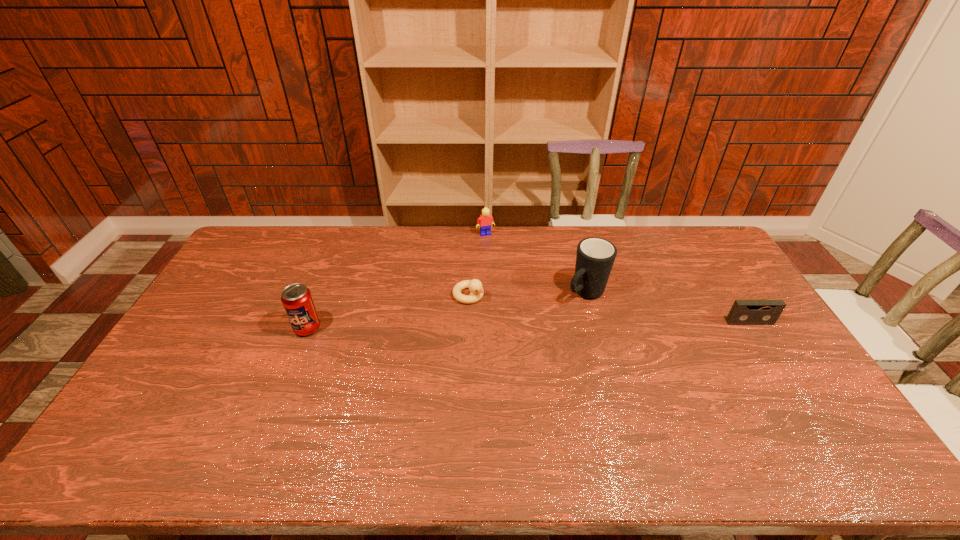
Locate an element on the screen. This screenshot has height=540, width=960. free location located 0.390m on the side of the second object from right to left with the handle is located at coordinates (492, 372).

Where is `vacant space located 0.170m on the side of the second object from right to left with the handle`? This screenshot has width=960, height=540. vacant space located 0.170m on the side of the second object from right to left with the handle is located at coordinates (540, 330).

Where is `vacant space located at the beak of the duckling`? Image resolution: width=960 pixels, height=540 pixels. vacant space located at the beak of the duckling is located at coordinates (553, 347).

Locate an element on the screen. This screenshot has height=540, width=960. vacant space located at the beak of the duckling is located at coordinates (579, 363).

I want to click on vacant region located 0.400m at the beak of the duckling, so click(x=585, y=366).

Find the location of a particular element. The height and width of the screenshot is (540, 960). free space located on the front-facing side of the Lego is located at coordinates (493, 248).

In order to click on vacant space located on the front-facing side of the Lego in this screenshot , I will do `click(503, 269)`.

This screenshot has height=540, width=960. I want to click on vacant space situated on the front-facing side of the Lego, so click(x=496, y=256).

Locate an element on the screen. object located in the far edge section of the desktop is located at coordinates (485, 220).

I want to click on object that is at the right edge, so click(743, 312).